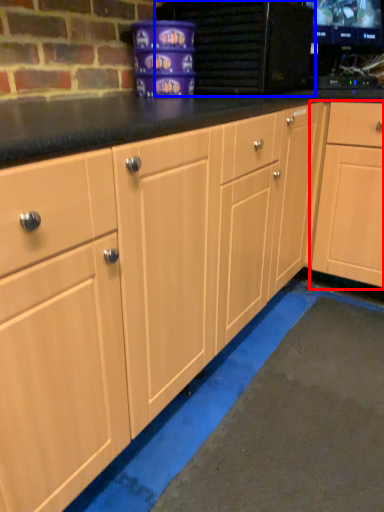
Question: Which object appears farthest to the camera in this image, cabinetry (highlighted by a red box) or appliance (highlighted by a blue box)?

Choices:
 (A) cabinetry
 (B) appliance

Answer: (A)